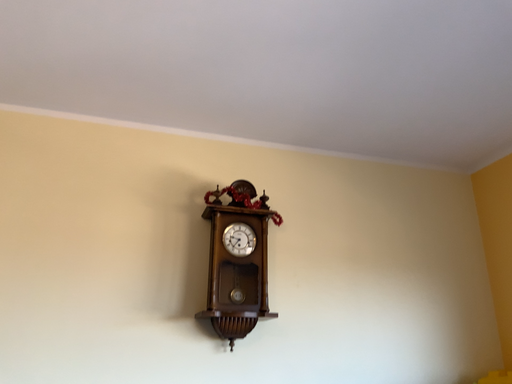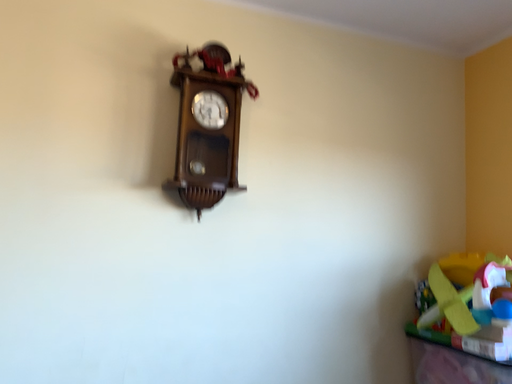
Question: How did the camera likely rotate when shooting the video?

Choices:
 (A) rotated upward
 (B) rotated downward

Answer: (B)